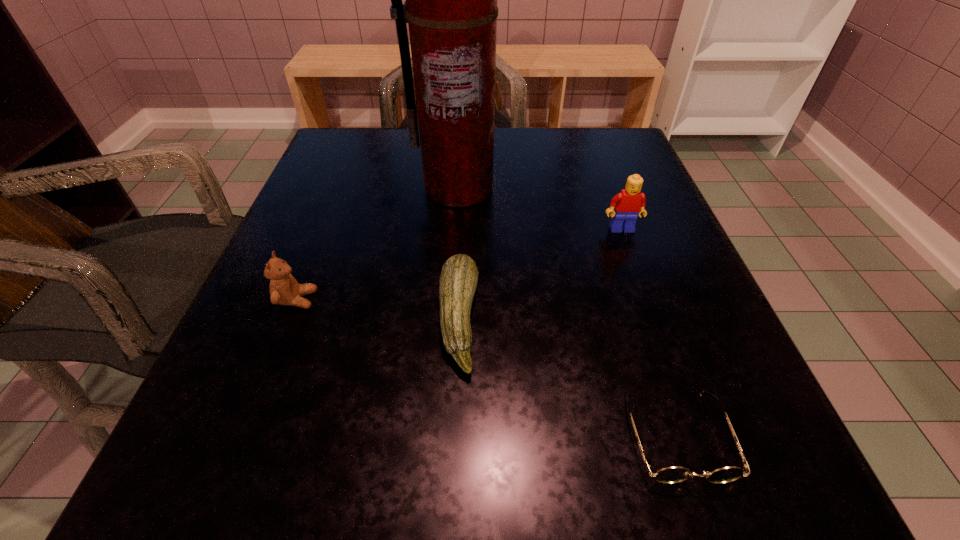
In the image, there is a desktop. Identify the location of blank space at the near edge. (580, 477).

In the image, there is a desktop. Find the location of `blank space at the left edge`. blank space at the left edge is located at coordinates (347, 225).

I want to click on vacant point at the right edge, so click(x=741, y=425).

This screenshot has height=540, width=960. In order to click on free space at the far left corner of the desktop in this screenshot , I will do `click(346, 167)`.

Find the location of a particular element. vacant area at the far right corner of the desktop is located at coordinates (558, 130).

Locate an element on the screen. free space between the fourth nearest object and the farthest object is located at coordinates (540, 209).

Find the location of a particular element. This screenshot has height=540, width=960. free space between the tallest object and the shortest object is located at coordinates (567, 312).

Locate an element on the screen. free space that is in between the fourth tallest object and the leftmost object is located at coordinates pos(377,309).

Where is `vacant space that is in between the zucchini and the teddy bear`? vacant space that is in between the zucchini and the teddy bear is located at coordinates (377, 309).

The image size is (960, 540). I want to click on empty location between the fire extinguisher and the shortest object, so click(x=567, y=312).